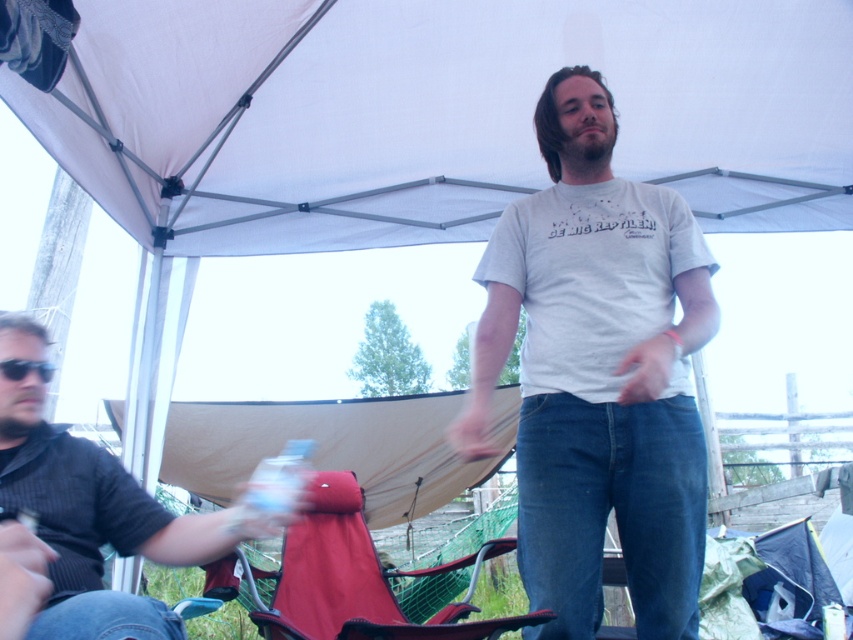
Is the position of matte red folding chair at lower center more distant than that of black plastic sunglasses at left?

Yes, matte red folding chair at lower center is further from the viewer.

Which is behind, point (306, 609) or point (9, 378)?

The point (306, 609) is behind.

Is point (315, 554) behind point (9, 360)?

Yes.

You are a GUI agent. You are given a task and a screenshot of the screen. Output one action in this format:
    pyautogui.click(x=<x>, y=<y>)
    Task: Click on the matte red folding chair at lower center
    This screenshot has width=853, height=640.
    Given the screenshot: What is the action you would take?
    pyautogui.click(x=352, y=579)

Image resolution: width=853 pixels, height=640 pixels. What do you see at coordinates (436, 113) in the screenshot? I see `white fabric canopy at center` at bounding box center [436, 113].

Between white fabric canopy at center and black plastic sunglasses at left, which one is positioned higher?

white fabric canopy at center is above.

Does point (351, 76) come behind point (25, 372)?

Yes, it is.

At what (x,y) coordinates should I click in order to perform the action: click on white fabric canopy at center. Please return your answer as a coordinate pair (x, y). Image resolution: width=853 pixels, height=640 pixels. Looking at the image, I should click on (436, 113).

Which is more to the left, white fabric canopy at center or white cotton t-shirt at center?

white fabric canopy at center

This screenshot has width=853, height=640. Find the location of `white fabric canopy at center`. white fabric canopy at center is located at coordinates (436, 113).

You are a GUI agent. You are given a task and a screenshot of the screen. Output one action in this format:
    pyautogui.click(x=<x>, y=<y>)
    Task: Click on the white fabric canopy at center
    Image resolution: width=853 pixels, height=640 pixels.
    Given the screenshot: What is the action you would take?
    pyautogui.click(x=436, y=113)